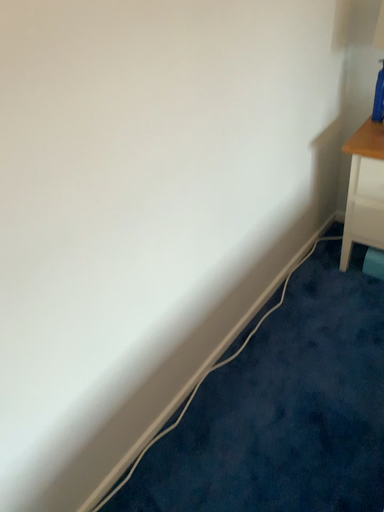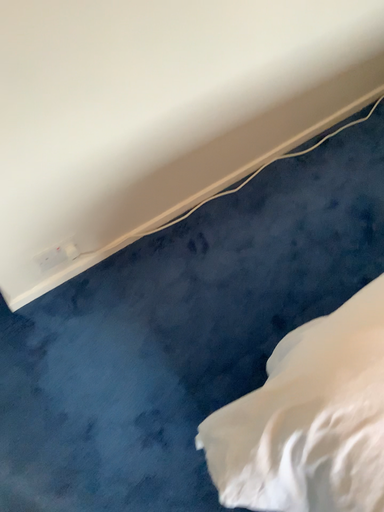
Question: Which way did the camera rotate in the video?

Choices:
 (A) rotated right
 (B) rotated left

Answer: (B)